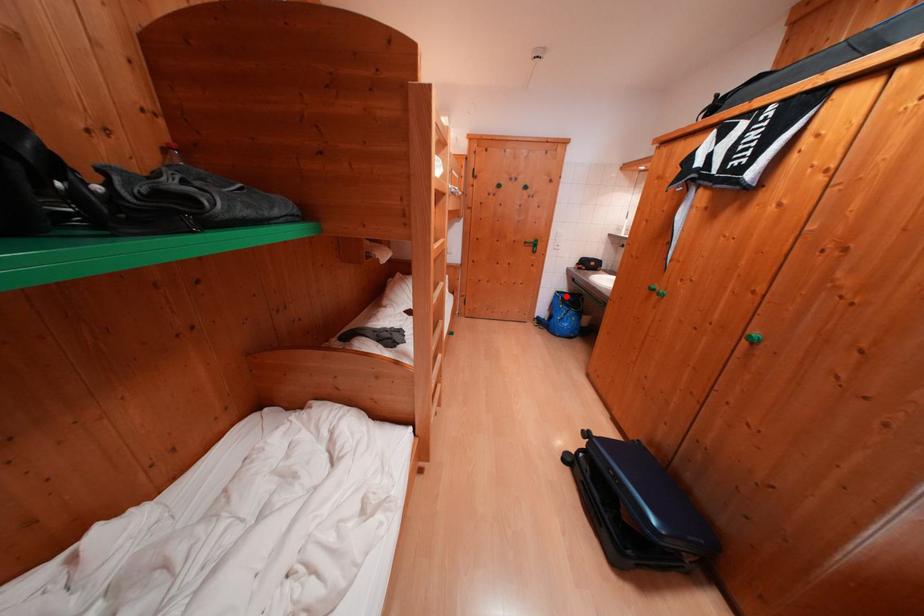
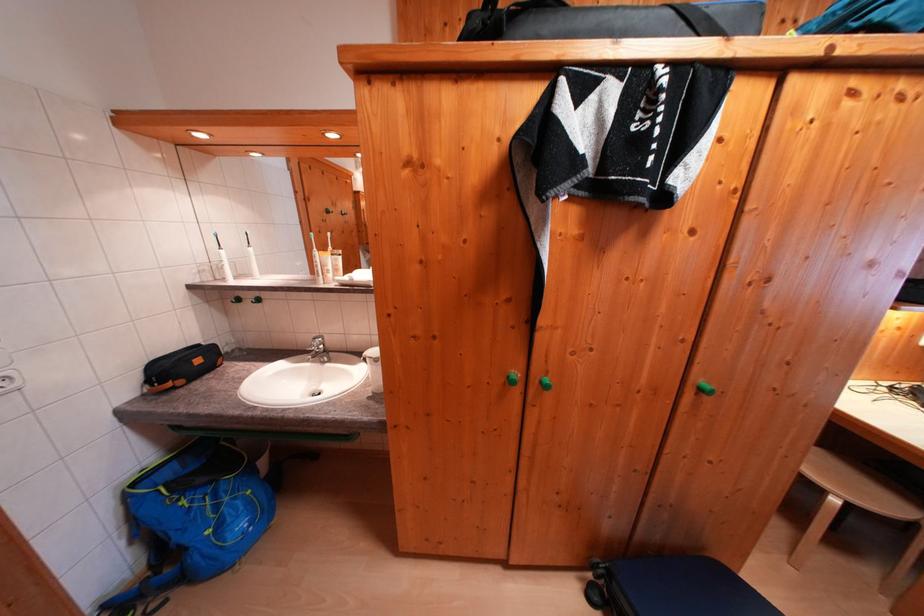
In the second image, find the point that corresponds to the highlighted location in the first image.

(142, 488)